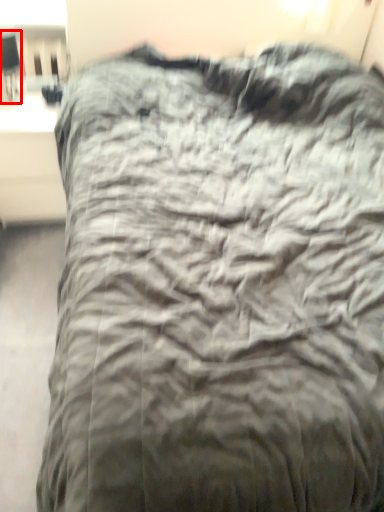
Question: Observing the image, what is the correct spatial positioning of table lamp (annotated by the red box) in reference to table?

Choices:
 (A) left
 (B) right

Answer: (A)